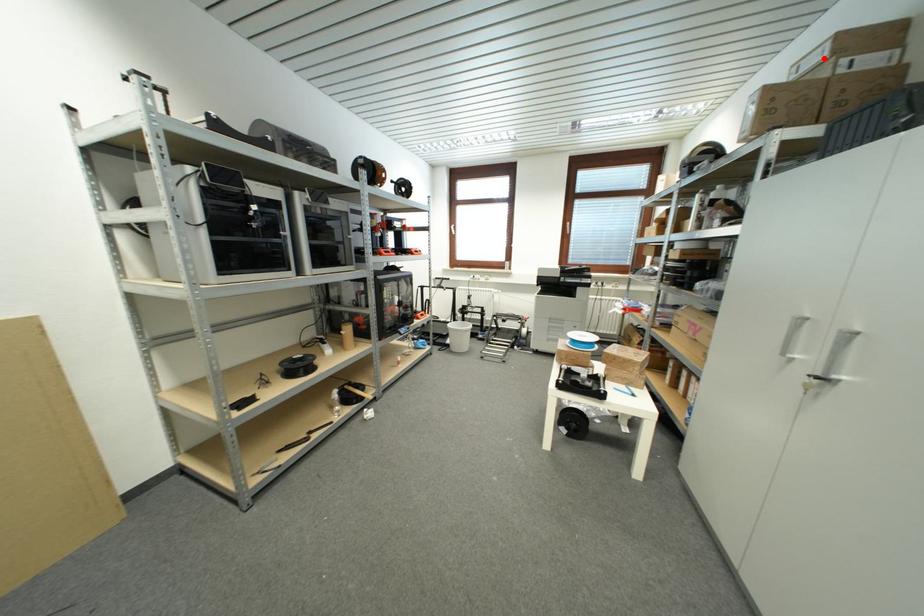
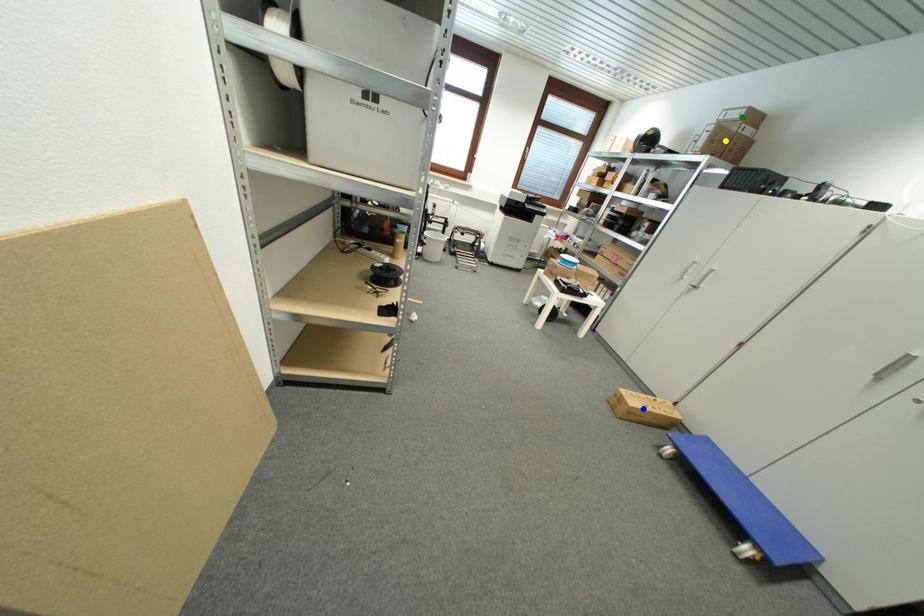
Question: I am providing you with two images of the same scene from different viewpoints. A red point is marked on the first image. You are given multiple points on the second image. Which point in image 2 is actually the same real-world point as the red point in image 1?

Choices:
 (A) green point
 (B) blue point
 (C) yellow point

Answer: (A)